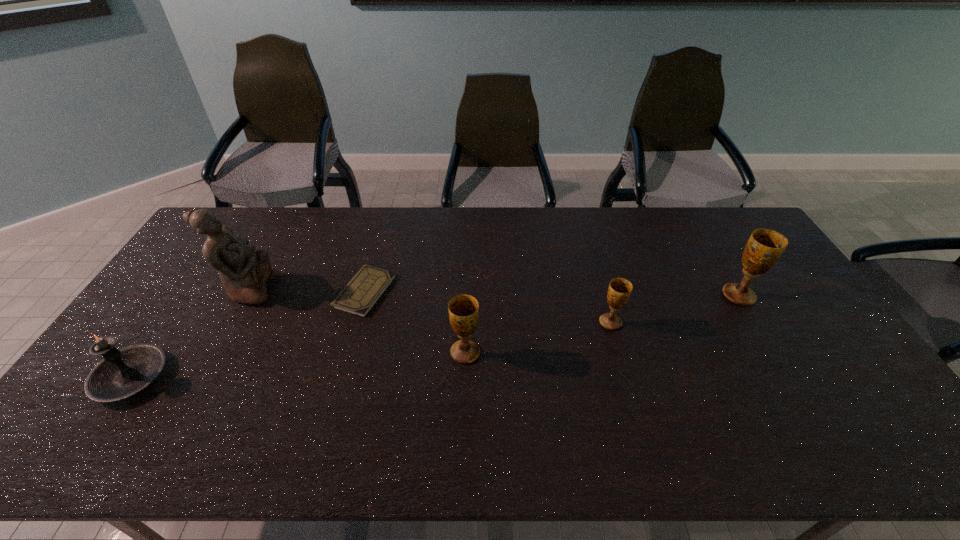
Locate an element on the screen. the third object from left to right is located at coordinates (359, 296).

At what (x,y) coordinates should I click in order to perform the action: click on vacant space situated 0.090m on the right of the second tallest chalice. Please return your answer as a coordinate pair (x, y). This screenshot has height=540, width=960. Looking at the image, I should click on (513, 353).

Find the location of a particular element. vacant region located 0.190m on the front of the shortest chalice is located at coordinates (629, 388).

I want to click on vacant space located 0.070m on the back of the tallest chalice, so click(723, 270).

Where is `free region located on the front-facing side of the tallest object`? Image resolution: width=960 pixels, height=540 pixels. free region located on the front-facing side of the tallest object is located at coordinates (331, 289).

I want to click on free location located 0.310m on the right of the leftmost object, so click(285, 377).

You are a GUI agent. You are given a task and a screenshot of the screen. Output one action in this format:
    pyautogui.click(x=<x>, y=<y>)
    Task: Click on the free space located 0.210m on the front of the shortest object
    This screenshot has width=960, height=540.
    Given the screenshot: What is the action you would take?
    pyautogui.click(x=341, y=378)

Locate an element on the screen. This screenshot has height=540, width=960. object that is positioned at the near edge is located at coordinates (122, 373).

You are a GUI agent. You are given a task and a screenshot of the screen. Output one action in this format:
    pyautogui.click(x=<x>, y=<y>)
    Task: Click on the object present at the left edge
    The image size is (960, 540).
    Given the screenshot: What is the action you would take?
    pyautogui.click(x=122, y=373)

Locate an element on the screen. This screenshot has height=540, width=960. object present at the right edge is located at coordinates (764, 248).